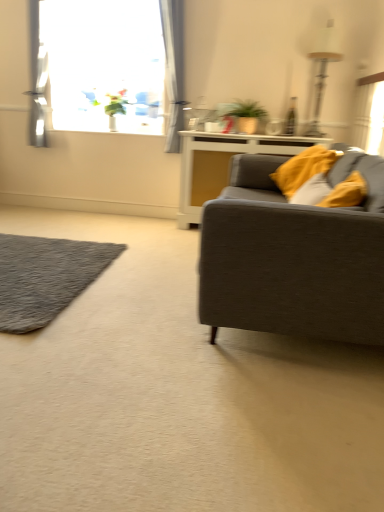
Question: Does transparent glass window at upper left have a lesser height compared to light gray sheer curtain at upper left?

Choices:
 (A) yes
 (B) no

Answer: (A)

Question: From the image's perspective, is transparent glass window at upper left beneath light gray sheer curtain at upper left?

Choices:
 (A) no
 (B) yes

Answer: (A)

Question: Can you confirm if transparent glass window at upper left is positioned to the left of light gray sheer curtain at upper left?

Choices:
 (A) no
 (B) yes

Answer: (B)

Question: From a real-world perspective, is transparent glass window at upper left under light gray sheer curtain at upper left?

Choices:
 (A) yes
 (B) no

Answer: (B)

Question: Does transparent glass window at upper left touch light gray sheer curtain at upper left?

Choices:
 (A) no
 (B) yes

Answer: (A)

Question: From a real-world perspective, is textured gray couch at right physically located above or below light gray sheer curtain at upper left?

Choices:
 (A) above
 (B) below

Answer: (B)

Question: Would you say textured gray couch at right is inside or outside light gray sheer curtain at upper left?

Choices:
 (A) outside
 (B) inside

Answer: (A)

Question: Based on their sizes in the image, would you say textured gray couch at right is bigger or smaller than light gray sheer curtain at upper left?

Choices:
 (A) small
 (B) big

Answer: (B)

Question: From the image's perspective, is textured gray couch at right above or below light gray sheer curtain at upper left?

Choices:
 (A) below
 (B) above

Answer: (A)

Question: Considering the positions of textured gray couch at right and transparent glass window at upper left in the image, is textured gray couch at right taller or shorter than transparent glass window at upper left?

Choices:
 (A) short
 (B) tall

Answer: (A)

Question: Is point pos(208,296) closer or farther from the camera than point pos(59,95)?

Choices:
 (A) closer
 (B) farther

Answer: (A)

Question: From a real-world perspective, is textured gray couch at right physically located above or below transparent glass window at upper left?

Choices:
 (A) above
 (B) below

Answer: (B)

Question: Do you think textured gray couch at right is within transparent glass window at upper left, or outside of it?

Choices:
 (A) inside
 (B) outside

Answer: (B)

Question: Looking at their shapes, would you say soft yellow pillow at right is wider or thinner than transparent glass window at upper left?

Choices:
 (A) wide
 (B) thin

Answer: (B)

Question: Is soft yellow pillow at right bigger or smaller than transparent glass window at upper left?

Choices:
 (A) big
 (B) small

Answer: (B)